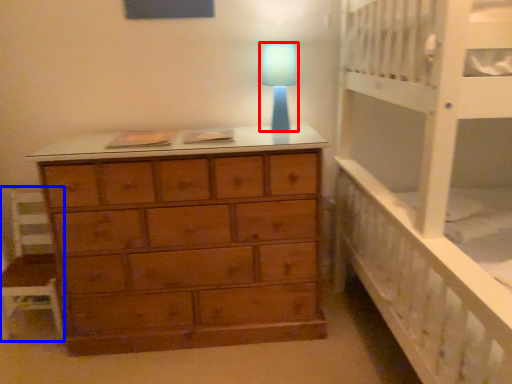
Question: Which object appears farthest to the camera in this image, lamp (highlighted by a red box) or chair (highlighted by a blue box)?

Choices:
 (A) lamp
 (B) chair

Answer: (B)